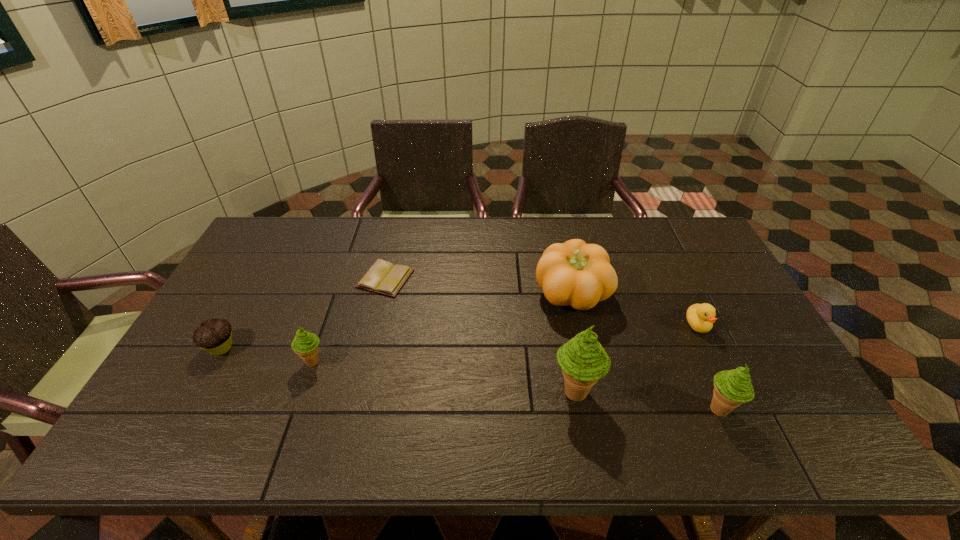
Where is `free location at the near edge`? This screenshot has height=540, width=960. free location at the near edge is located at coordinates (613, 394).

Image resolution: width=960 pixels, height=540 pixels. Identify the location of vacant space at the left edge of the desktop. coord(284,264).

The width and height of the screenshot is (960, 540). I want to click on vacant space at the right edge of the desktop, so click(x=750, y=316).

In the image, there is a desktop. Where is `free space at the far left corner`? The width and height of the screenshot is (960, 540). free space at the far left corner is located at coordinates [278, 231].

Where is `vacant space at the near left corner of the desktop`? This screenshot has width=960, height=540. vacant space at the near left corner of the desktop is located at coordinates (155, 406).

You are a GUI agent. You are given a task and a screenshot of the screen. Output one action in this format:
    pyautogui.click(x=<x>, y=<y>)
    Task: Click on the free spot between the sixth object from right to left and the diary
    
    Given the screenshot: What is the action you would take?
    pyautogui.click(x=349, y=320)

You are a GUI agent. You are given a task and a screenshot of the screen. Output one action in this format:
    pyautogui.click(x=<x>, y=<y>)
    Task: Click on the free space between the shortest object and the pumpkin
    
    Given the screenshot: What is the action you would take?
    pyautogui.click(x=479, y=287)

Find the location of `unoccupied area between the farthest icecream and the muffin`. unoccupied area between the farthest icecream and the muffin is located at coordinates (267, 355).

This screenshot has width=960, height=540. Find the location of `free space that is in between the second tallest icecream and the diary`. free space that is in between the second tallest icecream and the diary is located at coordinates (552, 344).

The image size is (960, 540). I want to click on vacant area that lies between the second shortest icecream and the muffin, so click(470, 379).